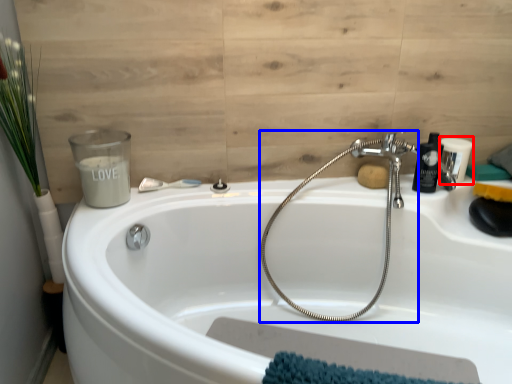
Question: Which of the following is the closest to the observer, toiletry (highlighted by a red box) or plumbing fixture (highlighted by a blue box)?

Choices:
 (A) toiletry
 (B) plumbing fixture

Answer: (B)